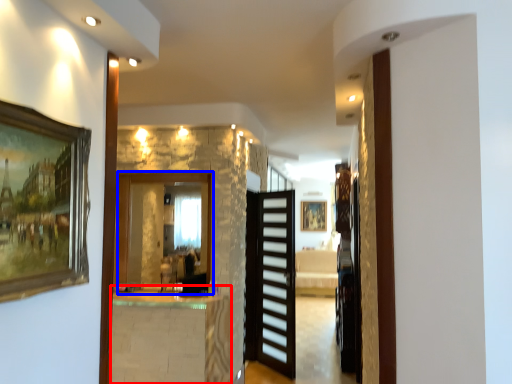
Question: Which of the following is the closest to the observer, table (highlighted by a red box) or mirror (highlighted by a blue box)?

Choices:
 (A) table
 (B) mirror

Answer: (A)